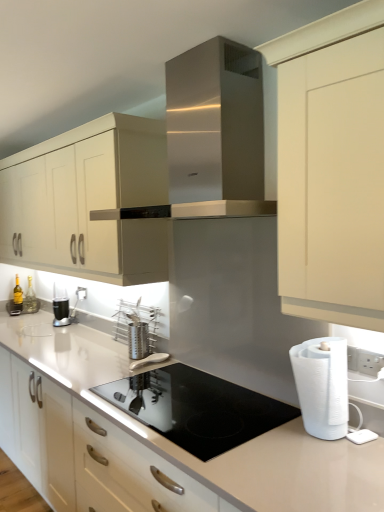
Question: Does satin silver utensil holder at center, marked as the second appliance in a top-to-bottom arrangement, have a greater height compared to metallic silver coffee machine at left?

Choices:
 (A) yes
 (B) no

Answer: (B)

Question: Is satin silver utensil holder at center, marked as the second appliance in a top-to-bottom arrangement, looking in the opposite direction of metallic silver coffee machine at left?

Choices:
 (A) yes
 (B) no

Answer: (B)

Question: Is satin silver utensil holder at center, placed as the 1th appliance when sorted from bottom to top, next to metallic silver coffee machine at left and touching it?

Choices:
 (A) no
 (B) yes

Answer: (A)

Question: Does satin silver utensil holder at center, marked as the second appliance in a top-to-bottom arrangement, have a larger size compared to metallic silver coffee machine at left?

Choices:
 (A) no
 (B) yes

Answer: (A)

Question: Does satin silver utensil holder at center, placed as the 1th appliance when sorted from bottom to top, have a greater width compared to metallic silver coffee machine at left?

Choices:
 (A) no
 (B) yes

Answer: (B)

Question: Can you confirm if satin silver utensil holder at center, marked as the second appliance in a top-to-bottom arrangement, is smaller than white plastic electric outlet at upper right?

Choices:
 (A) yes
 (B) no

Answer: (B)

Question: Does satin silver utensil holder at center, placed as the 1th appliance when sorted from bottom to top, come in front of white plastic electric outlet at upper right?

Choices:
 (A) yes
 (B) no

Answer: (A)

Question: From a real-world perspective, is satin silver utensil holder at center, marked as the second appliance in a top-to-bottom arrangement, below white plastic electric outlet at upper right?

Choices:
 (A) yes
 (B) no

Answer: (A)

Question: Does satin silver utensil holder at center, marked as the second appliance in a top-to-bottom arrangement, have a larger size compared to white plastic electric outlet at upper right?

Choices:
 (A) yes
 (B) no

Answer: (A)

Question: From a real-world perspective, is satin silver utensil holder at center, placed as the 1th appliance when sorted from bottom to top, located higher than white plastic electric outlet at upper right?

Choices:
 (A) yes
 (B) no

Answer: (B)

Question: Would you consider satin silver utensil holder at center, marked as the second appliance in a top-to-bottom arrangement, to be distant from white plastic electric outlet at upper right?

Choices:
 (A) no
 (B) yes

Answer: (B)

Question: From the image's perspective, is stainless steel utensil holder at center, acting as the 1th appliance starting from the top, on top of white matte paper towel at right?

Choices:
 (A) yes
 (B) no

Answer: (A)